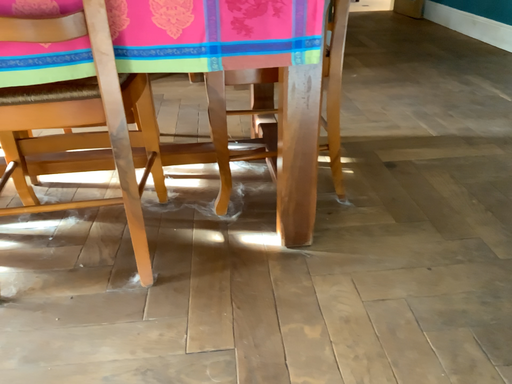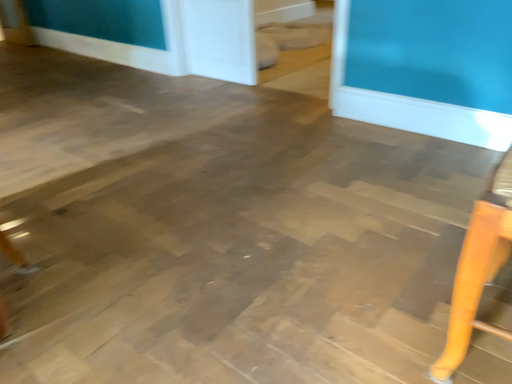
Question: Which way did the camera rotate in the video?

Choices:
 (A) rotated downward
 (B) rotated upward

Answer: (B)